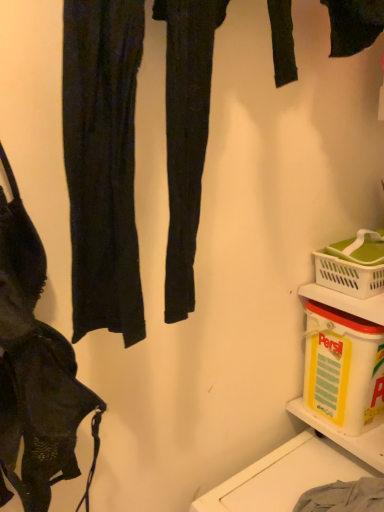
Question: Does point (354, 281) appear closer or farther from the camera than point (225, 481)?

Choices:
 (A) closer
 (B) farther

Answer: (B)

Question: In terms of height, does white plastic picnic basket at lower right look taller or shorter compared to gray cotton towel at lower right?

Choices:
 (A) tall
 (B) short

Answer: (B)

Question: Which of these objects is positioned closest to the white plastic container at lower right?

Choices:
 (A) white plastic picnic basket at lower right
 (B) gray cotton towel at lower right
 (C) matte black bra at left
 (D) yellow plastic container at lower right

Answer: (B)

Question: Estimate the real-world distances between objects in this image. Which object is closer to the gray cotton towel at lower right?

Choices:
 (A) yellow plastic container at lower right
 (B) white plastic container at lower right
 (C) matte black bra at left
 (D) white plastic picnic basket at lower right

Answer: (B)